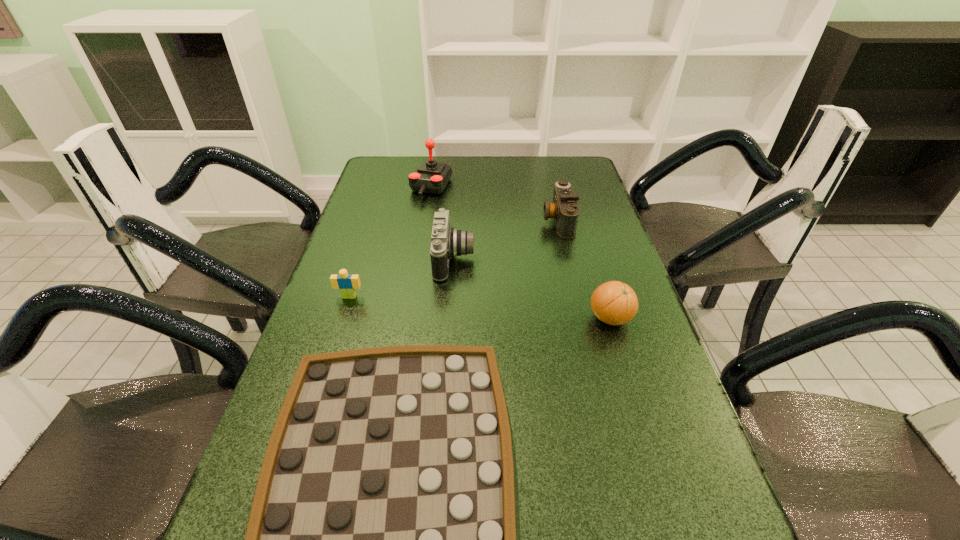
In order to click on object that is the second closest one to the joystick in this screenshot , I will do `click(564, 209)`.

This screenshot has height=540, width=960. What are the coordinates of `vacant region that satisfies the following two spatial constraints: 1. on the front-facing side of the fifth shortest object; 2. on the left side of the second nearest object` in the screenshot? It's located at (450, 319).

At what (x,y) coordinates should I click in order to perform the action: click on free spot that satisfies the following two spatial constraints: 1. on the front-facing side of the left camera; 2. on the face of the Lego. Please return your answer as a coordinate pair (x, y). Looking at the image, I should click on 451,296.

This screenshot has height=540, width=960. What are the coordinates of `vacant region that satisfies the following two spatial constraints: 1. on the front-facing side of the taller camera; 2. on the back side of the orange` in the screenshot? It's located at (450, 319).

Locate an element on the screen. The height and width of the screenshot is (540, 960). vacant space that satisfies the following two spatial constraints: 1. on the front side of the orange; 2. on the right side of the farthest object is located at coordinates (410, 319).

The width and height of the screenshot is (960, 540). Identify the location of free location that satisfies the following two spatial constraints: 1. on the front-facing side of the fifth shortest object; 2. on the left side of the orange. (450, 319).

Where is `free location that satisfies the following two spatial constraints: 1. on the face of the fourth farthest object; 2. on the left side of the orange`? free location that satisfies the following two spatial constraints: 1. on the face of the fourth farthest object; 2. on the left side of the orange is located at coordinates pyautogui.click(x=343, y=319).